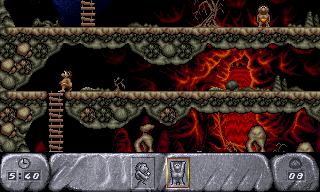
Image resolution: width=320 pixels, height=192 pixels. I want to click on wooden ladder, so click(90, 12), click(57, 108).